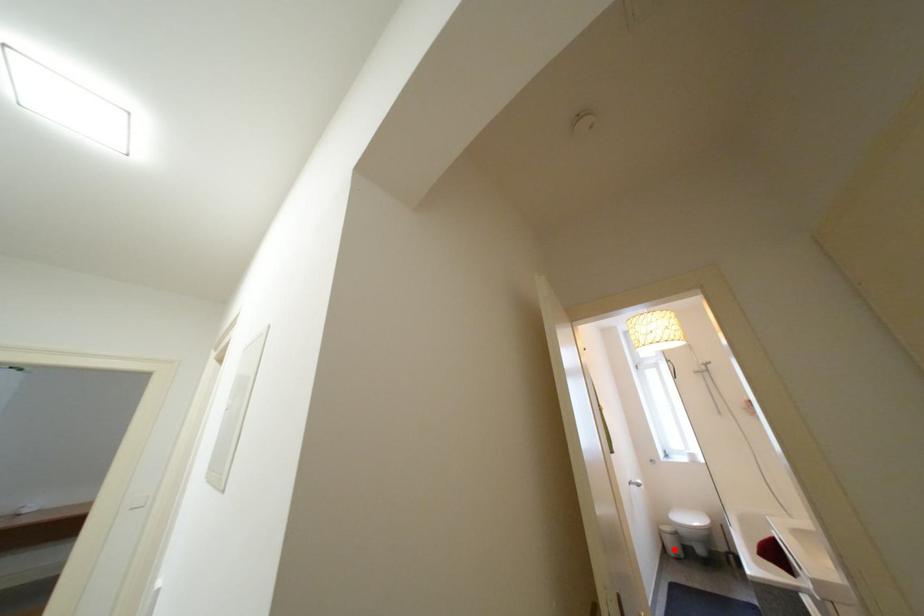
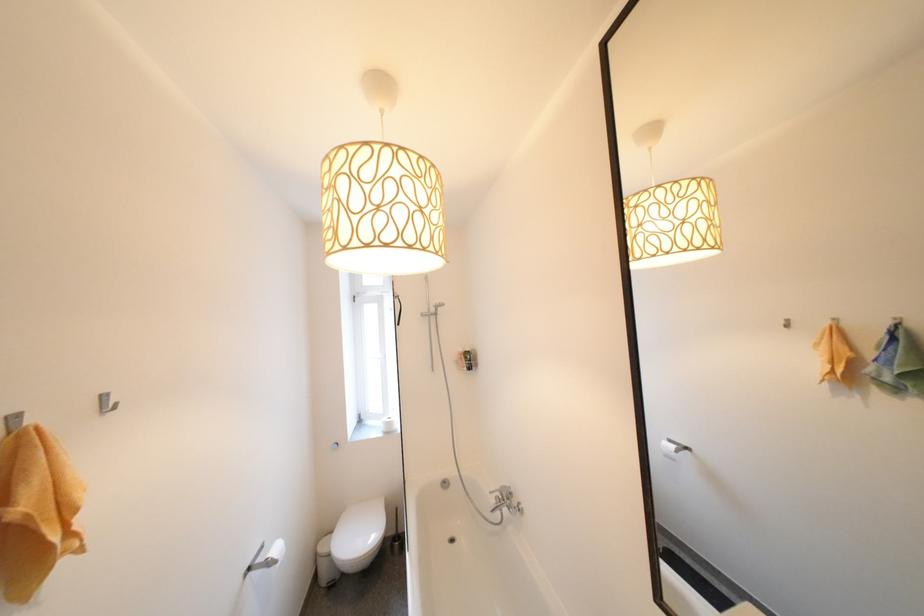
Locate, in the second image, the point that corresponds to the highlighted location in the first image.

(325, 578)